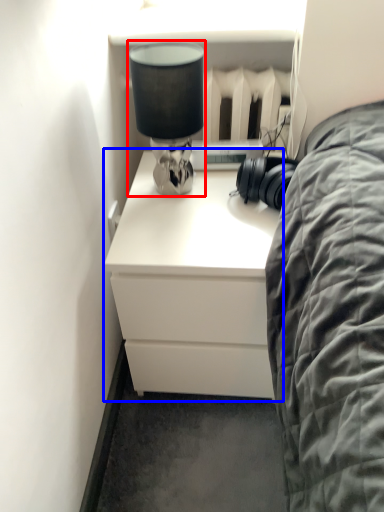
Question: Which object appears closest to the camera in this image, table lamp (highlighted by a red box) or chest of drawers (highlighted by a blue box)?

Choices:
 (A) table lamp
 (B) chest of drawers

Answer: (A)